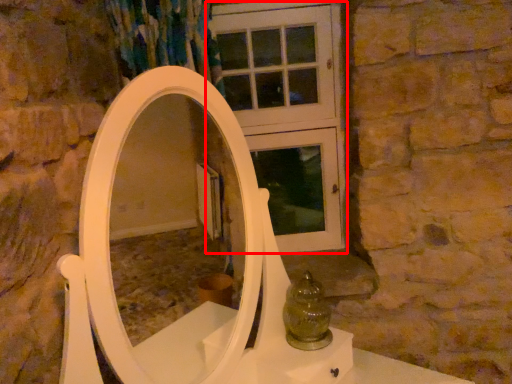
Question: In this image, where is screen door (annotated by the red box) located relative to glass vase?

Choices:
 (A) left
 (B) right

Answer: (A)